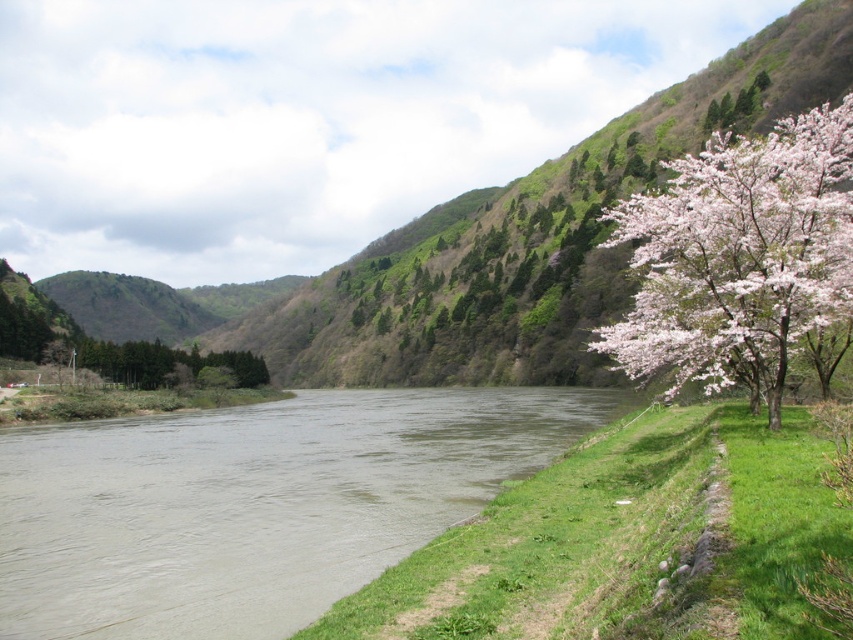
Question: Which of the following is the farthest from the observer?

Choices:
 (A) brown muddy water at lower left
 (B) pink bloom at right

Answer: (B)

Question: Which point is closer to the camera?

Choices:
 (A) brown muddy water at lower left
 (B) pink bloom at right

Answer: (A)

Question: Is brown muddy water at lower left positioned before pink bloom at right?

Choices:
 (A) yes
 (B) no

Answer: (A)

Question: Is brown muddy water at lower left smaller than pink bloom at right?

Choices:
 (A) yes
 (B) no

Answer: (A)

Question: Does brown muddy water at lower left have a greater width compared to pink bloom at right?

Choices:
 (A) no
 (B) yes

Answer: (B)